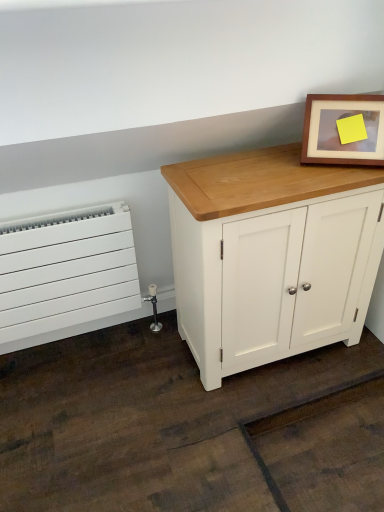
Where is `white matte radiator at left`? The width and height of the screenshot is (384, 512). white matte radiator at left is located at coordinates (67, 271).

The width and height of the screenshot is (384, 512). I want to click on wooden picture frame at upper right, so click(x=344, y=130).

Where is `white matte radiator at left`? white matte radiator at left is located at coordinates (67, 271).

From a real-world perspective, is white painted wood cabinet at center physically above white matte radiator at left?

Indeed, from a real-world perspective, white painted wood cabinet at center stands above white matte radiator at left.

From the image's perspective, is white painted wood cabinet at center over white matte radiator at left?

Yes.

Measure the distance from white painted wood cabinet at center to white matte radiator at left.

white painted wood cabinet at center is 19.09 inches away from white matte radiator at left.

Where is `picture frame behind the white painted wood cabinet at center`? picture frame behind the white painted wood cabinet at center is located at coordinates (344, 130).

Is wooden picture frame at upper right outside of white painted wood cabinet at center?

Yes.

From a real-world perspective, who is located lower, wooden picture frame at upper right or white painted wood cabinet at center?

white painted wood cabinet at center, from a real-world perspective.

Considering the positions of objects wooden picture frame at upper right and white painted wood cabinet at center in the image provided, who is behind, wooden picture frame at upper right or white painted wood cabinet at center?

wooden picture frame at upper right is further away from the camera.

Is white painted wood cabinet at center not close to wooden picture frame at upper right?

Actually, white painted wood cabinet at center and wooden picture frame at upper right are a little close together.

Could you tell me if white painted wood cabinet at center is turned towards wooden picture frame at upper right?

No, white painted wood cabinet at center does not turn towards wooden picture frame at upper right.

Is the position of white painted wood cabinet at center more distant than that of wooden picture frame at upper right?

No, it is in front of wooden picture frame at upper right.

Is wooden picture frame at upper right thinner than white matte radiator at left?

No.

From the image's perspective, between wooden picture frame at upper right and white matte radiator at left, which one is located above?

From the image's view, wooden picture frame at upper right is above.

Which object is positioned more to the right, wooden picture frame at upper right or white matte radiator at left?

From the viewer's perspective, wooden picture frame at upper right appears more on the right side.

Which object is further away from the camera taking this photo, wooden picture frame at upper right or white matte radiator at left?

white matte radiator at left is more distant.

Looking at the image, does white matte radiator at left seem bigger or smaller compared to wooden picture frame at upper right?

Considering their sizes, white matte radiator at left takes up more space than wooden picture frame at upper right.

From the image's perspective, relative to wooden picture frame at upper right, is white matte radiator at left above or below?

white matte radiator at left is situated lower than wooden picture frame at upper right in the image.

Measure the distance between white matte radiator at left and wooden picture frame at upper right.

They are 33.47 inches apart.

At what (x,y) coordinates should I click in order to perform the action: click on heater behind the white painted wood cabinet at center. Please return your answer as a coordinate pair (x, y). Image resolution: width=384 pixels, height=512 pixels. Looking at the image, I should click on (67, 271).

From a real-world perspective, does white matte radiator at left sit lower than white painted wood cabinet at center?

Yes, from a real-world perspective, white matte radiator at left is under white painted wood cabinet at center.

Between white matte radiator at left and white painted wood cabinet at center, which one has smaller width?

Thinner between the two is white matte radiator at left.

Considering the sizes of white matte radiator at left and white painted wood cabinet at center in the image, is white matte radiator at left taller or shorter than white painted wood cabinet at center?

white matte radiator at left is shorter than white painted wood cabinet at center.

What are the coordinates of `the chest of drawers that appears above the white matte radiator at left (from the image's perspective)` in the screenshot? It's located at (256, 231).

I want to click on chest of drawers below the wooden picture frame at upper right (from a real-world perspective), so click(x=256, y=231).

Looking at the image, which one is located further to white painted wood cabinet at center, white matte radiator at left or wooden picture frame at upper right?

white matte radiator at left lies further to white painted wood cabinet at center than the other object.

When comparing their distances from white matte radiator at left, does white painted wood cabinet at center or wooden picture frame at upper right seem closer?

Based on the image, white painted wood cabinet at center appears to be nearer to white matte radiator at left.

From the image, which object appears to be farther from white painted wood cabinet at center, wooden picture frame at upper right or white matte radiator at left?

white matte radiator at left is positioned further to the anchor white painted wood cabinet at center.

When comparing their distances from wooden picture frame at upper right, does white matte radiator at left or white painted wood cabinet at center seem further?

Based on the image, white matte radiator at left appears to be further to wooden picture frame at upper right.

When comparing their distances from white matte radiator at left, does wooden picture frame at upper right or white painted wood cabinet at center seem further?

The object further to white matte radiator at left is wooden picture frame at upper right.

Estimate the real-world distances between objects in this image. Which object is closer to wooden picture frame at upper right, white painted wood cabinet at center or white matte radiator at left?

Among the two, white painted wood cabinet at center is located nearer to wooden picture frame at upper right.

Where is `the chest of drawers situated between white matte radiator at left and wooden picture frame at upper right from left to right`? the chest of drawers situated between white matte radiator at left and wooden picture frame at upper right from left to right is located at coordinates pyautogui.click(x=256, y=231).